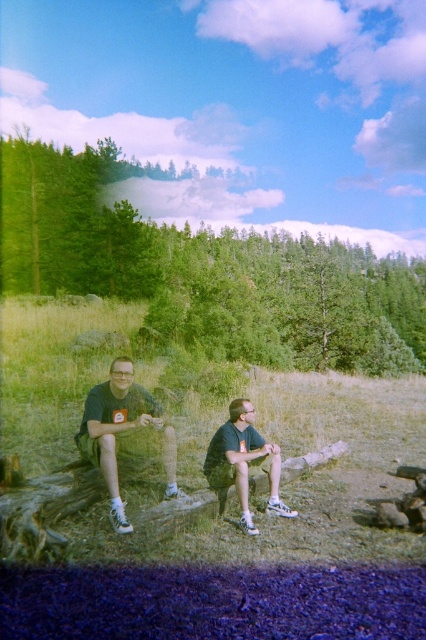
You are a hiker who needs to decide which clothing item to grab first from the center of the image. Based on their sizes, which item is taller between the dark green fabric shorts at center and the dark green fabric shirt at center?

The dark green fabric shorts at center is taller than the dark green fabric shirt at center.

Looking at this image, you are planning to set up a picnic blanket between the green leafy tree at upper left and the dark green fabric shirt at center. Given that the distance between them is 148.20 feet, what is the minimum length of the picnic blanket needed to cover the entire space between them?

The minimum length of the picnic blanket needed to cover the entire space between the green leafy tree at upper left and the dark green fabric shirt at center is 148.20 feet.

You are planning to take a photo of the dark green fabric shirt at center and the green leafy tree at upper left. Which object should you focus on first if you want to capture both in the same frame without adjusting your camera settings?

The green leafy tree at upper left is taller than the dark green fabric shirt at center, so you should focus on the green leafy tree at upper left first to ensure both are in focus.